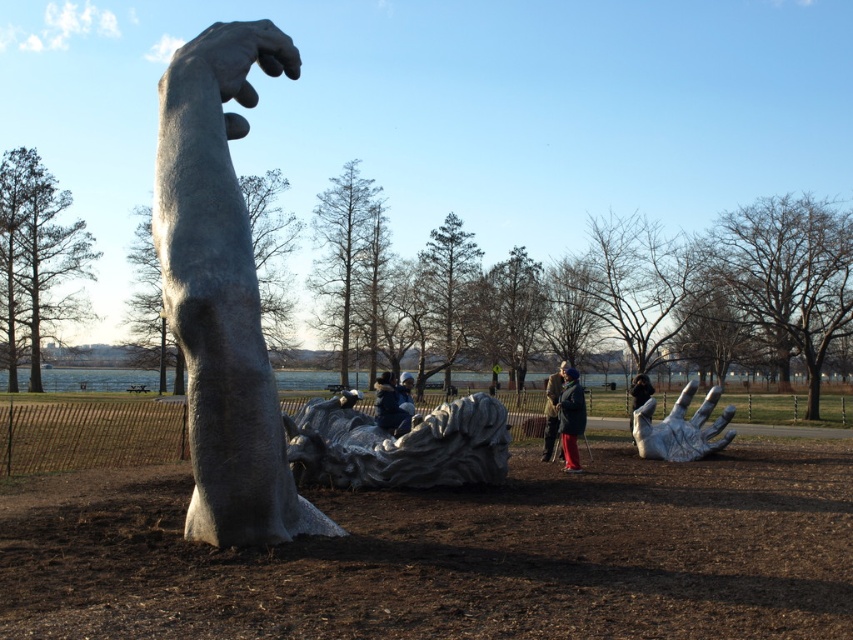
What object is located at the coordinates point (242,54) in the sculpture installation?

The point (242,54) corresponds to the sanded stone hand at upper center.

You are standing in front of the sculpture and see both the blue denim jacket at center and the dark brown leather jacket at center. Which jacket is located to the left when viewed from your perspective?

The blue denim jacket at center is positioned on the left side of the dark brown leather jacket at center, so it is located to the left when viewed from your perspective.